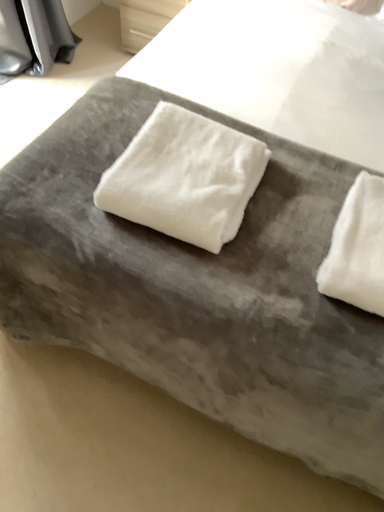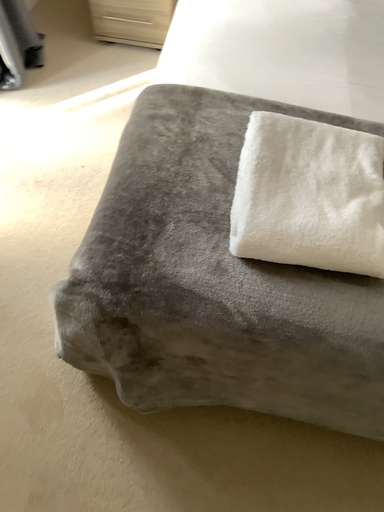
Question: How did the camera likely rotate when shooting the video?

Choices:
 (A) rotated right
 (B) rotated left

Answer: (A)